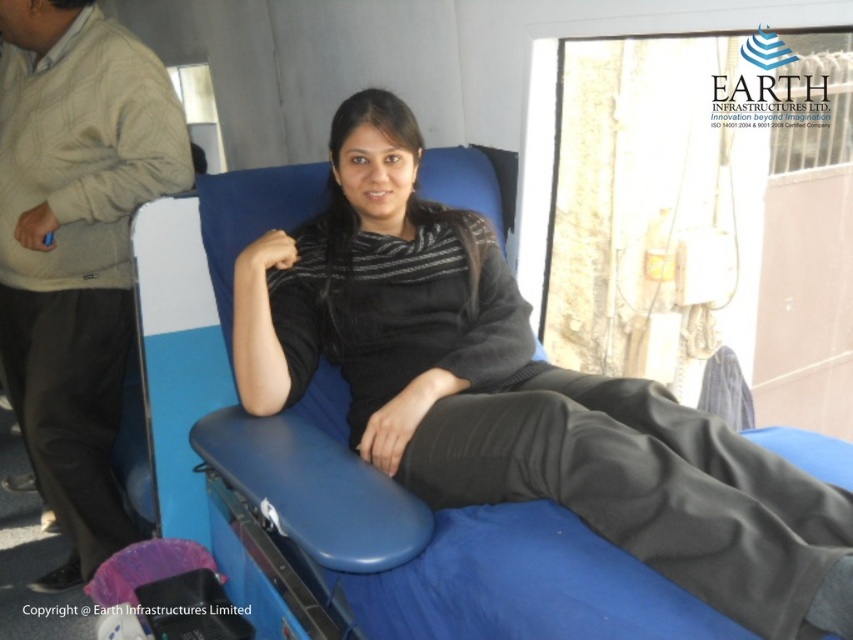
Image resolution: width=853 pixels, height=640 pixels. What do you see at coordinates (517, 394) in the screenshot?
I see `matte black sweater at center` at bounding box center [517, 394].

Between point (735, 506) and point (120, 243), which one is positioned in front?

Point (735, 506)

Where is `matte black sweater at center`? matte black sweater at center is located at coordinates (517, 394).

In order to click on matte black sweater at center in this screenshot , I will do `click(517, 394)`.